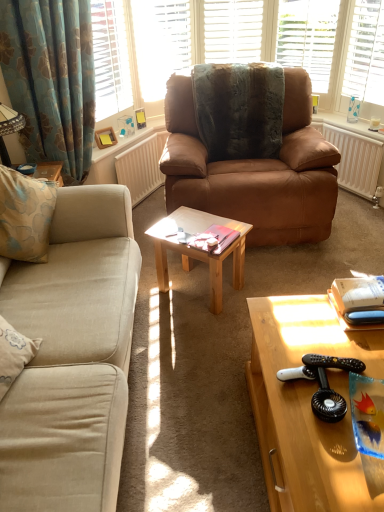
The width and height of the screenshot is (384, 512). In order to click on vacant region under matte pink book at center (from a real-world perspective) in this screenshot , I will do `click(228, 241)`.